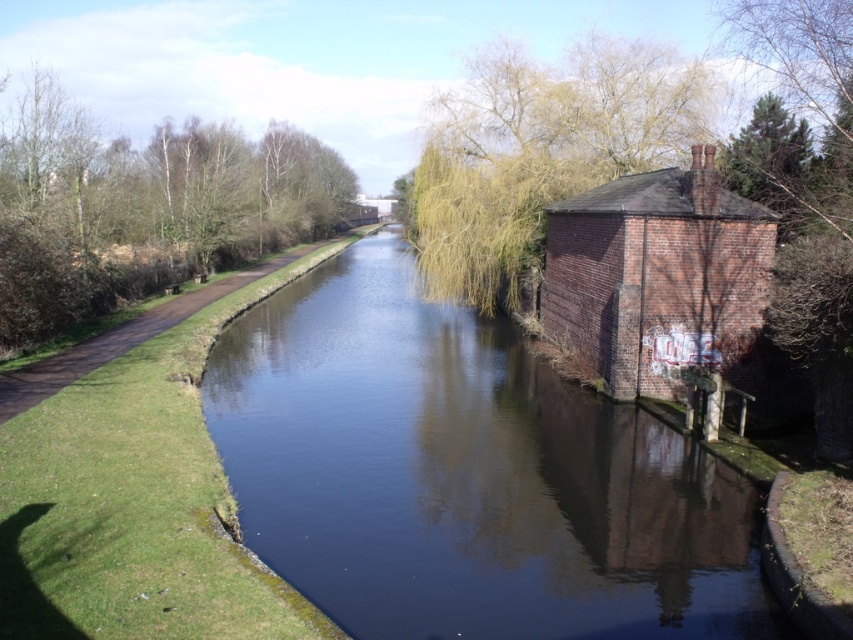
Is point (318, 362) positioned after point (791, 304)?

That is True.

Is point (397, 308) more distant than point (752, 164)?

That is True.

I want to click on dark blue water at center, so click(x=467, y=476).

Which of these two, brown leafy tree at upper left or green leafy tree at right, stands shorter?

green leafy tree at right

Does point (36, 244) come closer to viewer compared to point (807, 188)?

No, (36, 244) is further to viewer.

Locate an element on the screen. The image size is (853, 640). brown leafy tree at upper left is located at coordinates tap(143, 209).

Measure the distance between dark blue water at center and brown dirt path at left.

dark blue water at center and brown dirt path at left are 8.91 meters apart from each other.

Who is positioned more to the left, dark blue water at center or brown dirt path at left?

From the viewer's perspective, brown dirt path at left appears more on the left side.

Between point (207, 362) and point (25, 400), which one is positioned behind?

The point (207, 362) is more distant.

What are the coordinates of `dark blue water at center` in the screenshot? It's located at (467, 476).